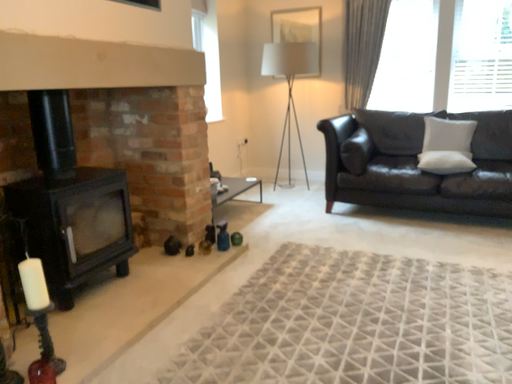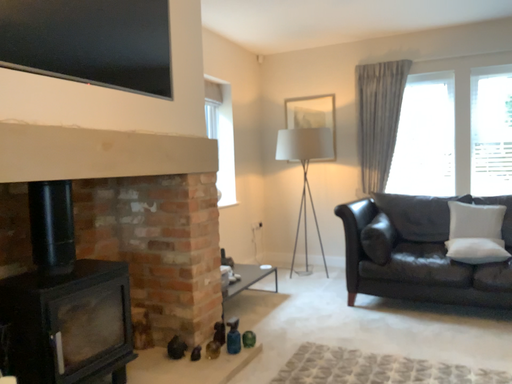
Question: Which way did the camera rotate in the video?

Choices:
 (A) rotated downward
 (B) rotated upward

Answer: (B)